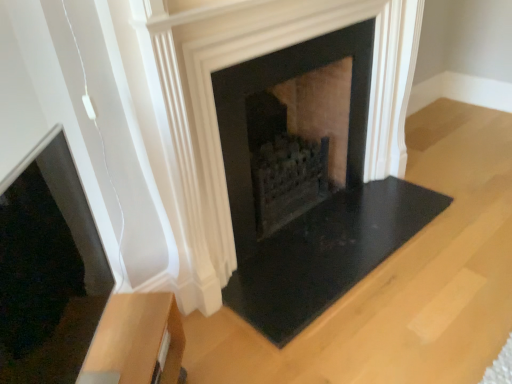
Question: Looking at the image, does black stone fireplace at center seem bigger or smaller compared to light brown wood side table at lower left?

Choices:
 (A) big
 (B) small

Answer: (A)

Question: From the image's perspective, is black stone fireplace at center positioned above or below light brown wood side table at lower left?

Choices:
 (A) above
 (B) below

Answer: (A)

Question: From a real-world perspective, relative to light brown wood side table at lower left, is black stone fireplace at center vertically above or below?

Choices:
 (A) below
 (B) above

Answer: (B)

Question: From a real-world perspective, is light brown wood side table at lower left physically located above or below black stone fireplace at center?

Choices:
 (A) above
 (B) below

Answer: (B)

Question: Considering the positions of light brown wood side table at lower left and black stone fireplace at center in the image, is light brown wood side table at lower left taller or shorter than black stone fireplace at center?

Choices:
 (A) short
 (B) tall

Answer: (A)

Question: Considering the relative positions of light brown wood side table at lower left and black stone fireplace at center in the image provided, is light brown wood side table at lower left to the left or to the right of black stone fireplace at center?

Choices:
 (A) left
 (B) right

Answer: (A)

Question: Is point (162, 327) positioned closer to the camera than point (352, 39)?

Choices:
 (A) closer
 (B) farther

Answer: (A)